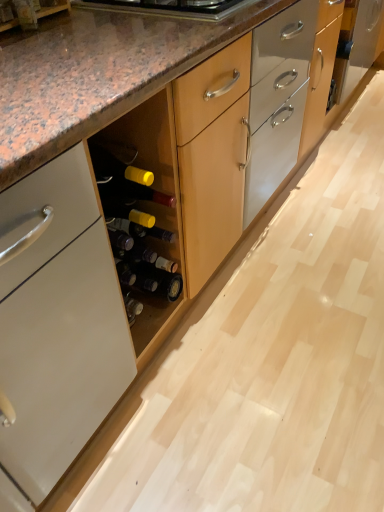
Question: In the image, is matte brown wood at lower left on the left side or the right side of matte glass beer bottle at center, the second beer bottle when ordered from bottom to top?

Choices:
 (A) right
 (B) left

Answer: (B)

Question: Considering the positions of point (54, 0) and point (145, 257), is point (54, 0) closer or farther from the camera than point (145, 257)?

Choices:
 (A) closer
 (B) farther

Answer: (A)

Question: Which of these objects is positioned closest to the matte black bottle at center, positioned as the first beer bottle in bottom-to-top order?

Choices:
 (A) matte glass beer bottle at center, the first beer bottle positioned from the top
 (B) matte brown wood at lower left
 (C) matte yellow glass wine bottle at center
 (D) wooden drawer at center
 (E) metallic stainless steel cooktop at upper center

Answer: (A)

Question: Which object is the farthest from the matte glass beer bottle at center, the second beer bottle when ordered from bottom to top?

Choices:
 (A) wooden drawer at center
 (B) matte yellow glass wine bottle at center
 (C) matte black bottle at center, positioned as the first beer bottle in bottom-to-top order
 (D) metallic stainless steel cooktop at upper center
 (E) matte brown wood at lower left

Answer: (A)